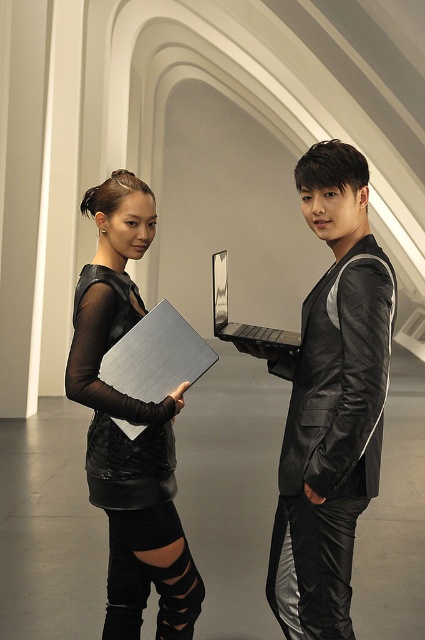
Can you confirm if black leather jacket at center is taller than black leather dress at left?

Correct, black leather jacket at center is much taller as black leather dress at left.

Who is more distant from viewer, (x=322, y=579) or (x=93, y=460)?

The point (x=93, y=460) is more distant.

I want to click on black leather jacket at center, so [x=331, y=401].

Who is more forward, (354, 490) or (115, 406)?

Point (354, 490) is more forward.

Does point (306, 618) come behind point (172, 554)?

No, it is not.

Does point (322, 598) lie in front of point (104, 484)?

That is True.

The image size is (425, 640). Identify the location of black leather jacket at center. (331, 401).

Does metallic silver laptop at center appear over black leather dress at left?

Incorrect, metallic silver laptop at center is not positioned above black leather dress at left.

Is metallic silver laptop at center thinner than black leather dress at left?

Incorrect, metallic silver laptop at center's width is not less than black leather dress at left's.

Which is behind, point (368, 499) or point (172, 499)?

The point (172, 499) is more distant.

The image size is (425, 640). I want to click on metallic silver laptop at center, so click(331, 401).